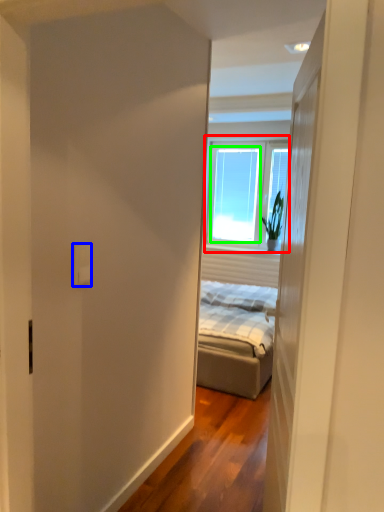
Question: Estimate the real-world distances between objects in this image. Which object is farther from window (highlighted by a red box), electric outlet (highlighted by a blue box) or window (highlighted by a green box)?

Choices:
 (A) electric outlet
 (B) window

Answer: (A)